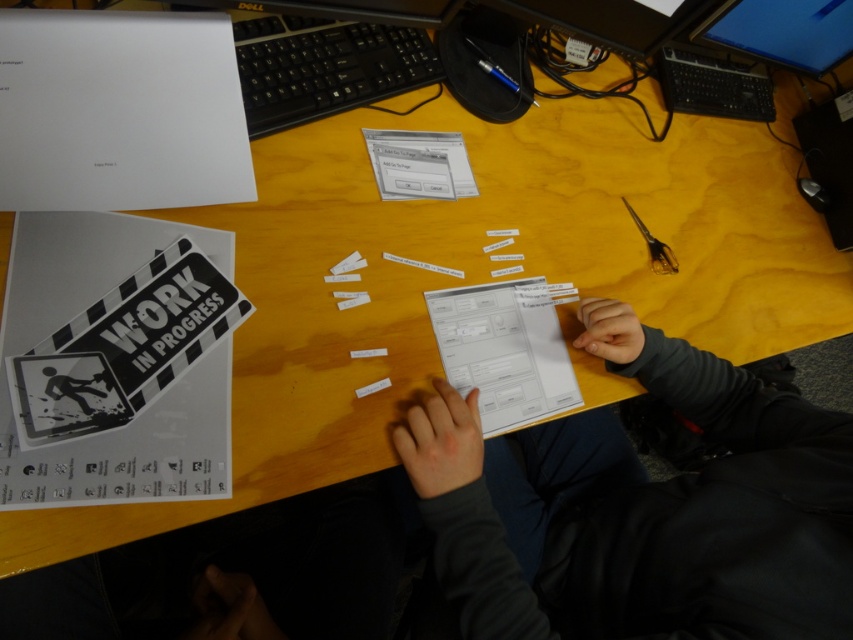
You are a delivery person who needs to place a small package on the desk without disturbing the dark gray sweater at center. The package is 12 inches wide. Can you safely place it next to the sweater?

The distance between dark gray sweater at center and the camera is 18.51 inches. Since the package is only 12 inches wide, there should be enough space to place it next to the sweater without disturbing it.

You are organizing the items on your desk and need to place the dark gray sweater at center and the white matte sign at lower left into a drawer. The drawer has a width of 30 cm. Based on their sizes, can both items fit side by side in the drawer?

The dark gray sweater at center is wider than the white matte sign at lower left. Since the sweater is larger in width, if the combined width of both items exceeds 30 cm, they might not fit. However, without exact measurements, it is uncertain. Please check the total width of both items against the drawer space.

You are standing in front of the desk and want to reach both the point at coordinates (x=274, y=52) and the point at coordinates (x=67, y=380). Which point will you reach first?

You will reach the point at coordinates (x=274, y=52) first because it is closer to you than the point at coordinates (x=67, y=380), which is further away.